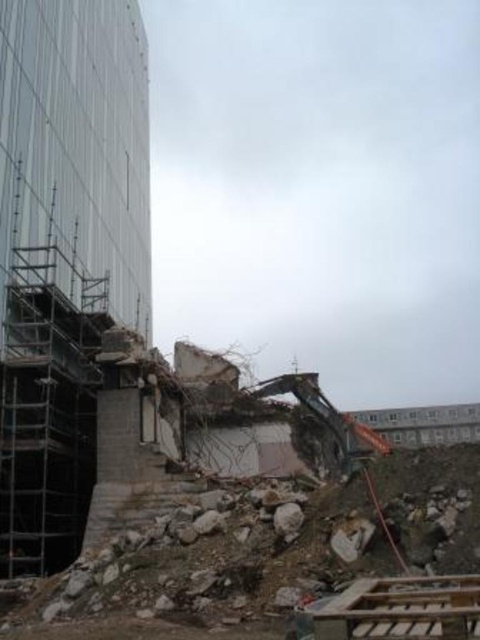
You are an engineer assessing the demolition site. You notice the rubble concrete at lower center and the metallic gray excavator at center. Which object is taller?

The rubble concrete at lower center is shorter than the metallic gray excavator at center, so the metallic gray excavator at center is taller.

You are a construction worker standing at the point marked as point [210,572]. You need to move to the rubble concrete at lower center. Is the rubble concrete at lower center your current location?

The rubble concrete at lower center is located at point [210,572], so yes, you are currently standing on the rubble concrete at lower center.

You are a construction worker standing at the center of the construction site. You need to place a new safety sign at the rubble concrete at lower center. According to the coordinates provided, where should you place the safety sign?

The rubble concrete at lower center is located at coordinates point (210,572), so you should place the safety sign there.